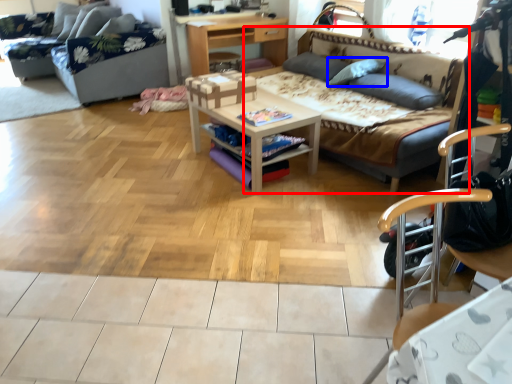
Question: Which object is further to the camera taking this photo, studio couch (highlighted by a red box) or pillow (highlighted by a blue box)?

Choices:
 (A) studio couch
 (B) pillow

Answer: (B)